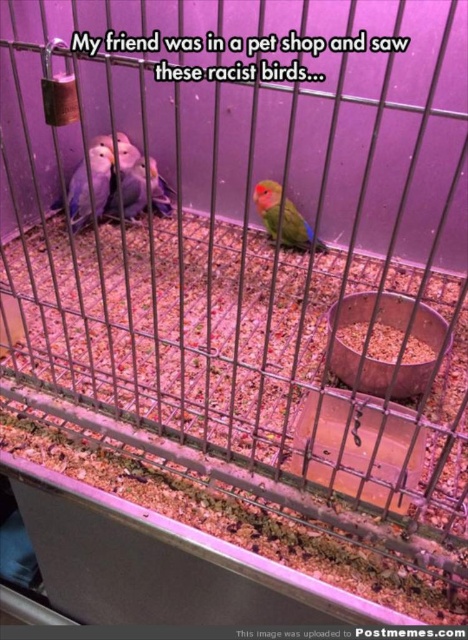
Looking at this image, is matte blue bird at center-left positioned at the back of matte orange parrot at center?

Yes, it is behind matte orange parrot at center.

Is matte blue bird at center-left bigger than matte orange parrot at center?

Indeed, matte blue bird at center-left has a larger size compared to matte orange parrot at center.

Is point (68, 195) behind point (301, 248)?

Yes, it is.

Where is `matte blue bird at center-left`? matte blue bird at center-left is located at coordinates (101, 173).